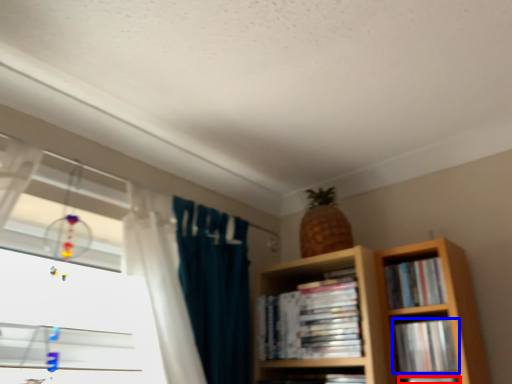
Question: Which point is further to the camera, book (highlighted by a red box) or book (highlighted by a blue box)?

Choices:
 (A) book
 (B) book

Answer: (B)